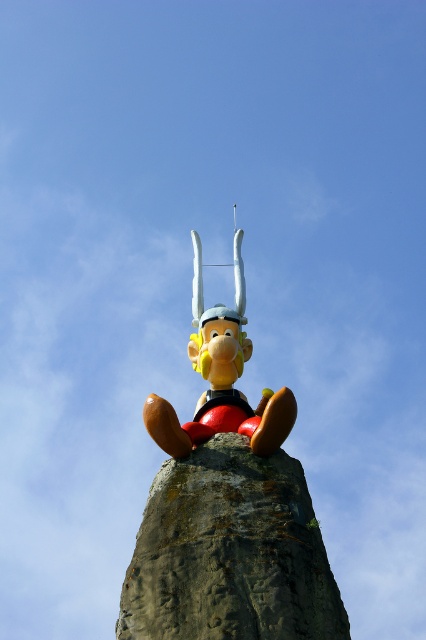
Between point (290, 467) and point (242, 273), which one is positioned in front?

Positioned in front is point (290, 467).

Who is shorter, rusty stone monument at center or shiny plastic statue at center?

rusty stone monument at center

The width and height of the screenshot is (426, 640). In order to click on rusty stone monument at center in this screenshot , I will do `click(230, 552)`.

Does matte plastic statue at center lie in front of shiny plastic statue at center?

Yes, matte plastic statue at center is closer to the viewer.

Is matte plastic statue at center above shiny plastic statue at center?

Actually, matte plastic statue at center is below shiny plastic statue at center.

Who is more forward, (204, 358) or (250, 352)?

Point (204, 358) is in front.

Image resolution: width=426 pixels, height=640 pixels. I want to click on matte plastic statue at center, so click(227, 508).

Is matte plastic statue at center above rusty stone monument at center?

Yes, matte plastic statue at center is above rusty stone monument at center.

Is matte plastic statue at center further to camera compared to rusty stone monument at center?

Yes, it is.

Between point (267, 461) and point (227, 528), which one is positioned in front?

Point (227, 528)

Image resolution: width=426 pixels, height=640 pixels. In order to click on matte plastic statue at center in this screenshot , I will do point(227,508).